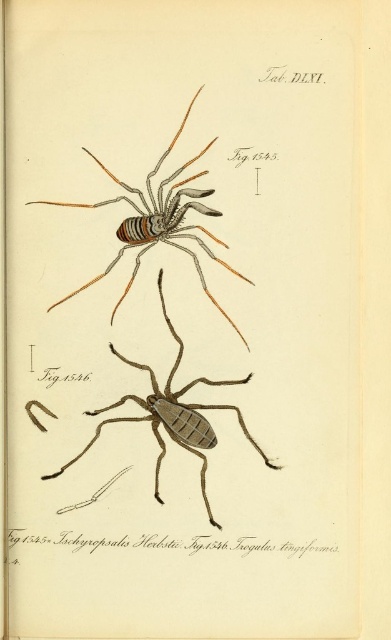
Question: Can you confirm if matte striped spider at upper center is thinner than brown matte spider at center?

Choices:
 (A) yes
 (B) no

Answer: (A)

Question: Which object appears closest to the camera in this image?

Choices:
 (A) matte striped spider at upper center
 (B) brown matte spider at center

Answer: (A)

Question: Considering the relative positions of matte striped spider at upper center and brown matte spider at center in the image provided, where is matte striped spider at upper center located with respect to brown matte spider at center?

Choices:
 (A) above
 (B) below

Answer: (A)

Question: Which of the following is the farthest from the observer?

Choices:
 (A) (134, 266)
 (B) (206, 449)

Answer: (A)

Question: In this image, where is matte striped spider at upper center located relative to brown matte spider at center?

Choices:
 (A) right
 (B) left

Answer: (B)